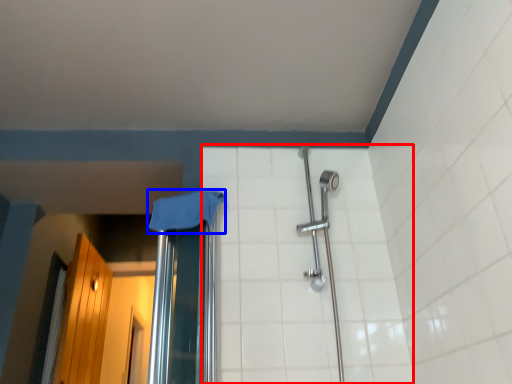
Question: Which object appears closest to the camera in this image, ceramic tile (highlighted by a red box) or cloth (highlighted by a blue box)?

Choices:
 (A) ceramic tile
 (B) cloth

Answer: (A)